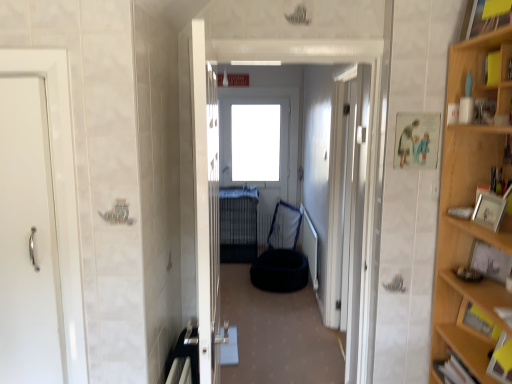
Question: Is dark blue fabric bean bag at center completely or partially inside dark blue fabric pet bed at center?

Choices:
 (A) no
 (B) yes

Answer: (A)

Question: Is dark blue fabric pet bed at center facing towards dark blue fabric bean bag at center?

Choices:
 (A) no
 (B) yes

Answer: (A)

Question: Can you confirm if dark blue fabric pet bed at center is smaller than dark blue fabric bean bag at center?

Choices:
 (A) yes
 (B) no

Answer: (B)

Question: From a real-world perspective, is dark blue fabric pet bed at center on top of dark blue fabric bean bag at center?

Choices:
 (A) no
 (B) yes

Answer: (B)

Question: Considering the relative sizes of dark blue fabric pet bed at center and dark blue fabric bean bag at center in the image provided, is dark blue fabric pet bed at center taller than dark blue fabric bean bag at center?

Choices:
 (A) no
 (B) yes

Answer: (B)

Question: Based on their sizes in the image, would you say white glossy door at left, positioned as the 2th door in back-to-front order, is bigger or smaller than wooden picture frame at right, placed as the first picture frame when sorted from right to left?

Choices:
 (A) small
 (B) big

Answer: (B)

Question: Considering the positions of white glossy door at left, which is the 3th door in right-to-left order, and wooden picture frame at right, the first picture frame in the bottom-to-top sequence, in the image, is white glossy door at left, which is the 3th door in right-to-left order, wider or thinner than wooden picture frame at right, the first picture frame in the bottom-to-top sequence,?

Choices:
 (A) wide
 (B) thin

Answer: (A)

Question: From the image's perspective, is white glossy door at left, which appears as the 2th door when viewed from the front, located above or below wooden picture frame at right, marked as the 2th picture frame in a front-to-back arrangement?

Choices:
 (A) above
 (B) below

Answer: (A)

Question: From a real-world perspective, is white glossy door at left, which appears as the 2th door when viewed from the front, above or below wooden picture frame at right, which is counted as the 2th picture frame, starting from the left?

Choices:
 (A) below
 (B) above

Answer: (B)

Question: Considering the positions of white glossy door at center, which is the first door in right-to-left order, and yellow paper at upper right in the image, is white glossy door at center, which is the first door in right-to-left order, bigger or smaller than yellow paper at upper right?

Choices:
 (A) small
 (B) big

Answer: (B)

Question: From the image's perspective, is white glossy door at center, placed as the 1th door when sorted from back to front, located above or below yellow paper at upper right?

Choices:
 (A) below
 (B) above

Answer: (A)

Question: Is white glossy door at center, which is the third door from left to right, spatially inside yellow paper at upper right, or outside of it?

Choices:
 (A) inside
 (B) outside

Answer: (B)

Question: Considering the relative positions of white glossy door at center, which is the 3th door in front-to-back order, and yellow paper at upper right in the image provided, is white glossy door at center, which is the 3th door in front-to-back order, to the left or to the right of yellow paper at upper right?

Choices:
 (A) right
 (B) left

Answer: (B)

Question: From the image's perspective, is dark blue fabric pet bed at center above or below light wood cabinet at right?

Choices:
 (A) above
 (B) below

Answer: (A)

Question: Is dark blue fabric pet bed at center taller or shorter than light wood cabinet at right?

Choices:
 (A) tall
 (B) short

Answer: (A)